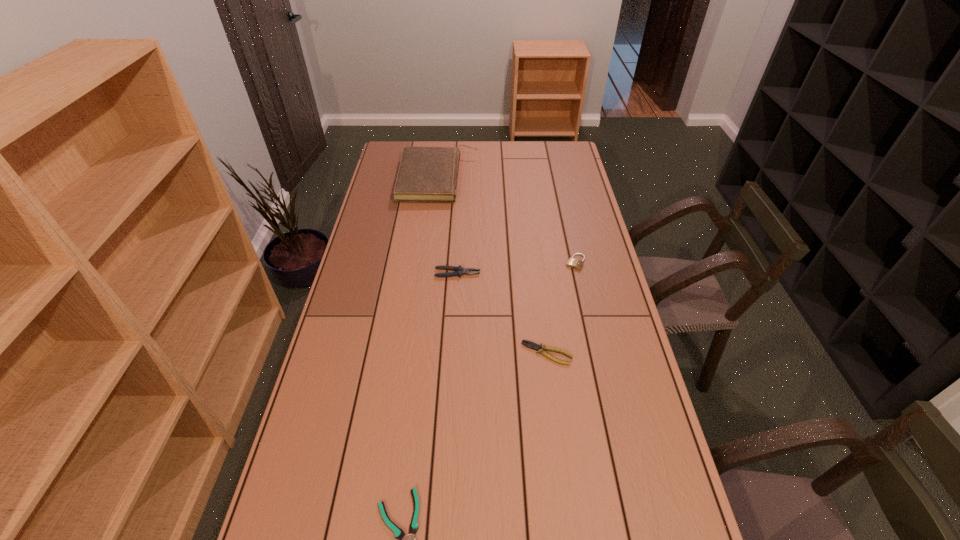
Identify the location of free space that satisfies the following two spatial constraints: 1. on the spine side of the paperback book; 2. on the right side of the fourth farthest object. The height and width of the screenshot is (540, 960). (418, 353).